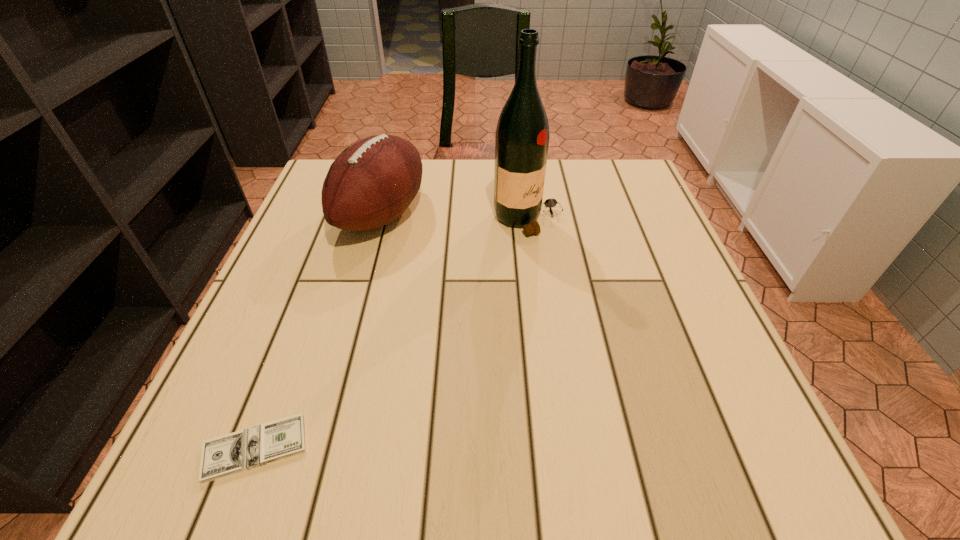
Identify which object is the closest to the tallest object. Please provide its 2D coordinates. Your answer should be formatted as a tuple, i.e. [(x, y)], where the tuple contains the x and y coordinates of a point satisfying the conditions above.

[(371, 183)]

Identify which object is the second nearest to the football (American). Please provide its 2D coordinates. Your answer should be formatted as a tuple, i.e. [(x, y)], where the tuple contains the x and y coordinates of a point satisfying the conditions above.

[(229, 454)]

This screenshot has height=540, width=960. I want to click on vacant area that satisfies the following two spatial constraints: 1. on the back side of the nearest object; 2. on the left side of the tallest object, so click(x=341, y=220).